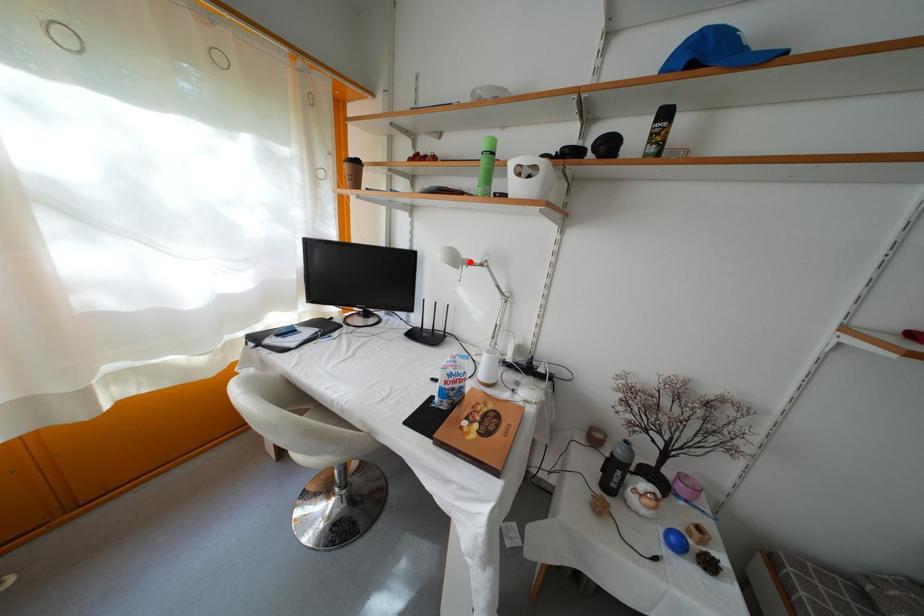
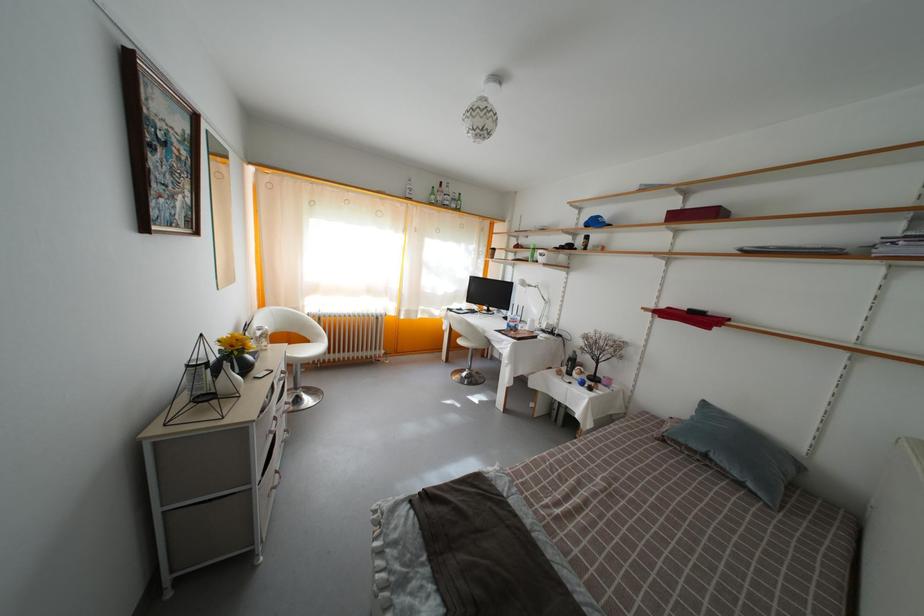
Question: A red point is marked in image1. In image2, is the corresponding 3D point closer to the camera or farther? Reply with the corresponding letter.

Choices:
 (A) The corresponding 3D point is closer.
 (B) The corresponding 3D point is farther.

Answer: (A)